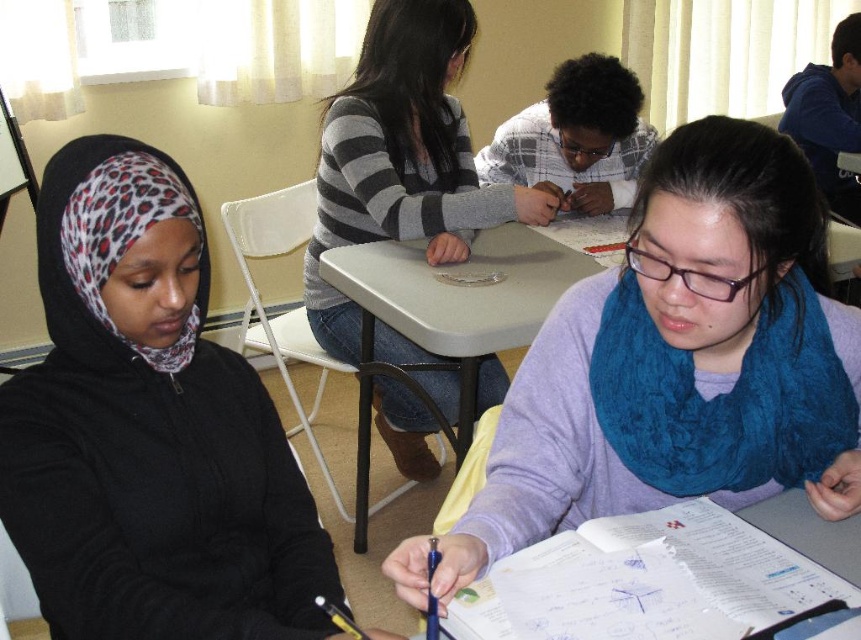
Question: Observing the image, what is the correct spatial positioning of purple soft scarf at center in reference to striped sweater at center?

Choices:
 (A) right
 (B) left

Answer: (A)

Question: In this image, where is leopard print hijab at left located relative to plaid fabric shirt at center?

Choices:
 (A) below
 (B) above

Answer: (A)

Question: Estimate the real-world distances between objects in this image. Which object is farther from the striped sweater at center?

Choices:
 (A) plaid fabric shirt at center
 (B) purple soft scarf at center
 (C) leopard print hijab at left

Answer: (C)

Question: Which is farther from the purple soft scarf at center?

Choices:
 (A) plaid fabric shirt at center
 (B) striped sweater at center

Answer: (A)

Question: Which point is closer to the camera?

Choices:
 (A) plaid fabric shirt at center
 (B) striped sweater at center
 (C) purple soft scarf at center

Answer: (C)

Question: Can you confirm if leopard print hijab at left is bigger than striped sweater at center?

Choices:
 (A) yes
 (B) no

Answer: (B)